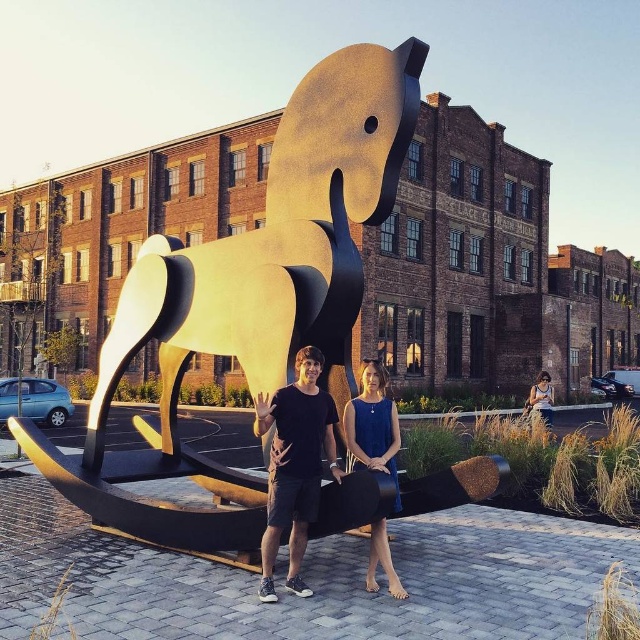
Which is above, black matte shirt at center or denim dress at lower right?

black matte shirt at center

Who is lower down, black matte shirt at center or denim dress at lower right?

Positioned lower is denim dress at lower right.

Between point (276, 413) and point (545, 413), which one is positioned in front?

Positioned in front is point (276, 413).

Identify the location of black matte shirt at center. (294, 465).

Does point (360, 388) lie in front of point (529, 410)?

Yes, it is.

Does blue satin dress at center have a lesser width compared to denim dress at lower right?

Yes.

Who is more forward, (x=360, y=412) or (x=548, y=412)?

Positioned in front is point (x=360, y=412).

Identify the location of blue satin dress at center. This screenshot has height=640, width=640. (372, 426).

Which is above, gold polished metal horse at center or black matte shirt at center?

gold polished metal horse at center

Between gold polished metal horse at center and black matte shirt at center, which one has more height?

black matte shirt at center

Where is `gold polished metal horse at center`? Image resolution: width=640 pixels, height=640 pixels. gold polished metal horse at center is located at coordinates (248, 296).